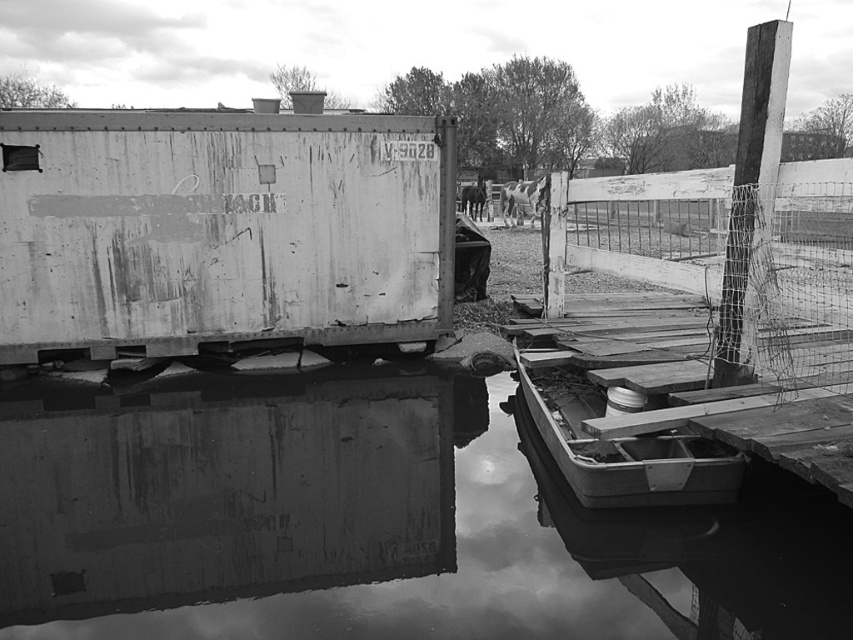
You are standing at the point with coordinates point (619, 464) and want to see the point (270, 301). Can you see it directly without moving?

No, because point (270, 301) is behind point (619, 464) from your current position.